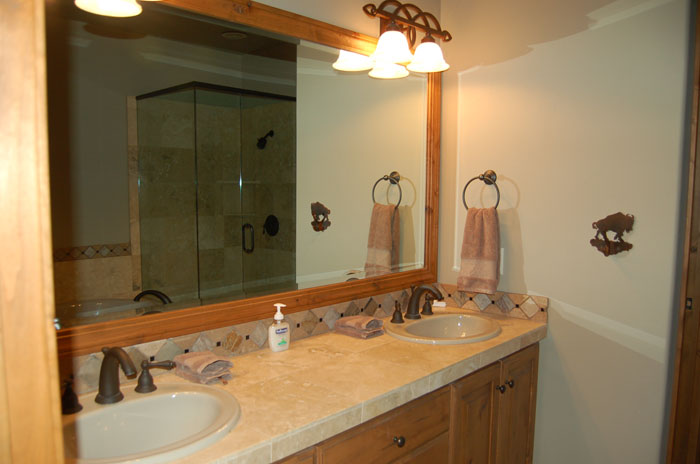
Where is `water faucet handles`? The image size is (700, 464). water faucet handles is located at coordinates (428, 307), (400, 318), (148, 379), (71, 399).